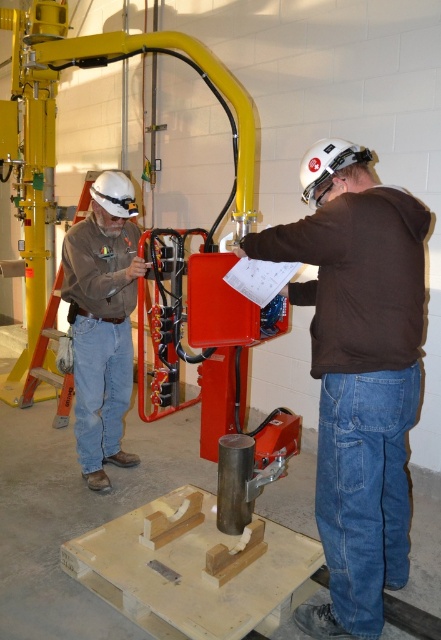
Which is more to the left, matte brown shirt at left or white matte helmet at upper center?

matte brown shirt at left is more to the left.

Between point (115, 371) and point (367, 156), which one is positioned in front?

Point (367, 156)

Does point (114, 272) come in front of point (328, 163)?

No, it is behind (328, 163).

I want to click on matte brown shirt at left, so click(x=103, y=323).

Who is lower down, brown matte jacket at center or matte brown shirt at left?

brown matte jacket at center is lower down.

You are a GUI agent. You are given a task and a screenshot of the screen. Output one action in this format:
    pyautogui.click(x=<x>, y=<y>)
    Task: Click on the brown matte jacket at center
    Image resolution: width=441 pixels, height=640 pixels.
    Given the screenshot: What is the action you would take?
    pyautogui.click(x=358, y=372)

Can you confirm if brown matte jacket at center is wider than white matte helmet at upper left?

Correct, the width of brown matte jacket at center exceeds that of white matte helmet at upper left.

Describe the element at coordinates (358, 372) in the screenshot. Image resolution: width=441 pixels, height=640 pixels. I see `brown matte jacket at center` at that location.

Image resolution: width=441 pixels, height=640 pixels. In order to click on brown matte jacket at center in this screenshot , I will do `click(358, 372)`.